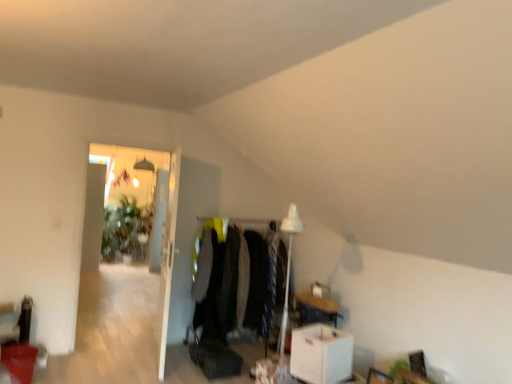
I want to click on vacant location below white glossy door at upper left (from a real-world perspective), so click(158, 365).